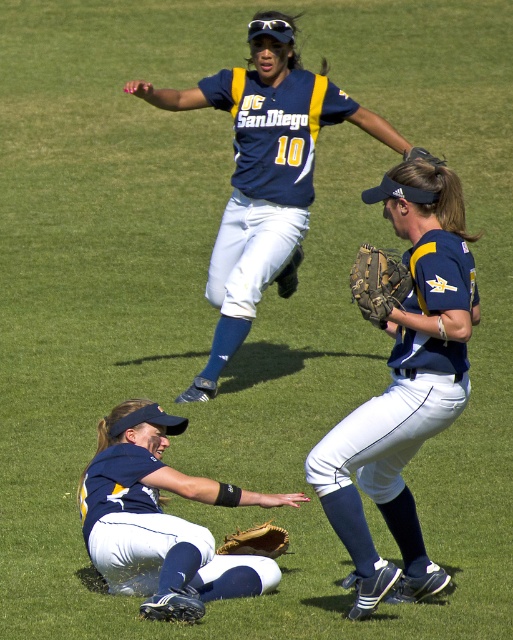
Is matte blue uniform at center behind brown leather glove at lower center?

No, it is in front of brown leather glove at lower center.

Which is below, matte blue uniform at center or brown leather glove at lower center?

brown leather glove at lower center is below.

Measure the distance between matte blue uniform at center and camera.

matte blue uniform at center is 6.76 meters from camera.

Where is `matte blue uniform at center`? Image resolution: width=513 pixels, height=640 pixels. matte blue uniform at center is located at coordinates (404, 385).

Is matte blue glove at lower left smaller than brown leather baseball glove at center?

Incorrect, matte blue glove at lower left is not smaller in size than brown leather baseball glove at center.

Which is in front, point (89, 536) or point (392, 272)?

Point (392, 272) is in front.

Locate an element on the screen. matte blue glove at lower left is located at coordinates (162, 520).

Is matte blue uniform at center wider than matte blue glove at lower left?

Incorrect, matte blue uniform at center's width does not surpass matte blue glove at lower left's.

From the picture: Is matte blue uniform at center positioned at the back of matte blue glove at lower left?

No, it is not.

Is point (455, 248) positioned in front of point (151, 532)?

Yes, point (455, 248) is closer to viewer.

Find the location of a particular element. matte blue uniform at center is located at coordinates (404, 385).